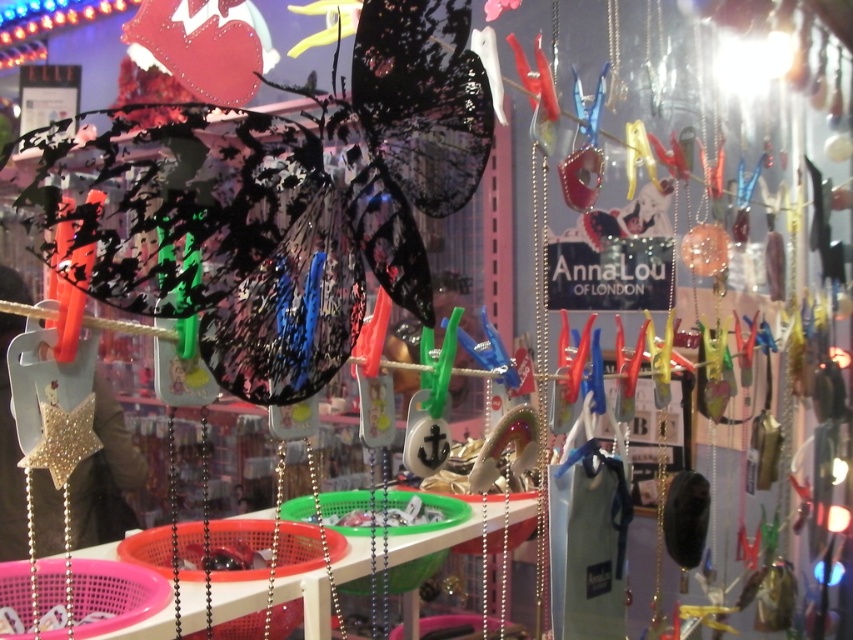
Question: Which object appears farthest from the camera in this image?

Choices:
 (A) silver metallic chain at center
 (B) transparent glossy butterfly at center

Answer: (A)

Question: Is transparent glossy butterfly at center above silver metallic chain at center?

Choices:
 (A) no
 (B) yes

Answer: (B)

Question: Observing the image, what is the correct spatial positioning of transparent glossy butterfly at center in reference to silver metallic chain at center?

Choices:
 (A) right
 (B) left

Answer: (A)

Question: Does transparent glossy butterfly at center have a smaller size compared to silver metallic chain at center?

Choices:
 (A) no
 (B) yes

Answer: (A)